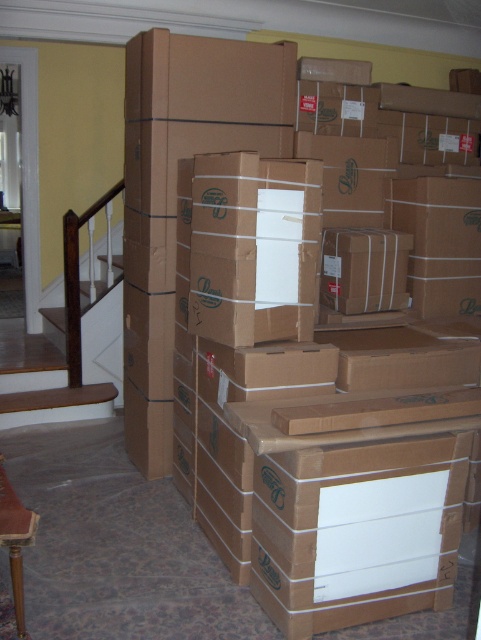
Question: Can you confirm if brown cardboard box at center is thinner than wooden at left?

Choices:
 (A) no
 (B) yes

Answer: (A)

Question: Which of the following is the closest to the observer?

Choices:
 (A) (460, 378)
 (B) (88, 416)

Answer: (A)

Question: Does brown cardboard box at center appear over wooden at left?

Choices:
 (A) yes
 (B) no

Answer: (A)

Question: Can you confirm if brown cardboard box at center is positioned above wooden at left?

Choices:
 (A) yes
 (B) no

Answer: (A)